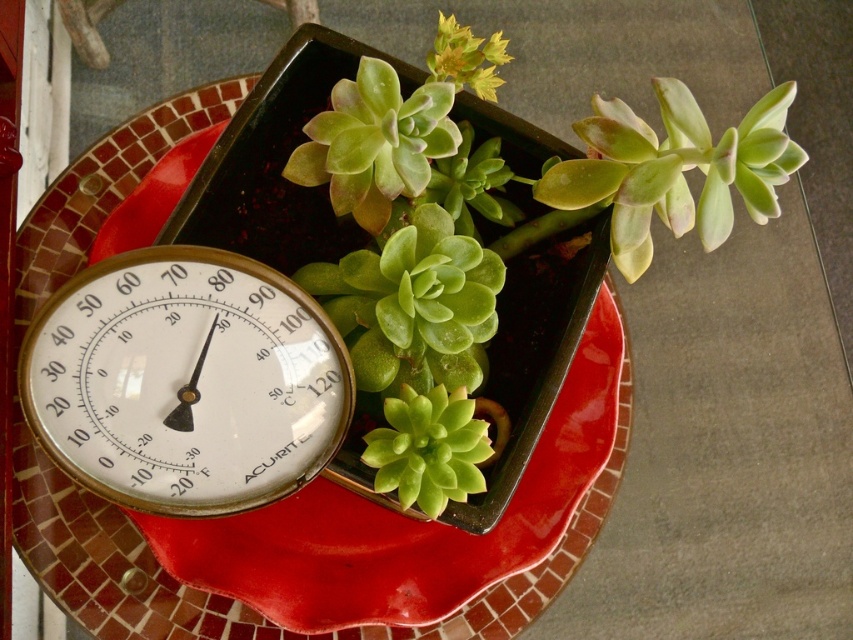
You are planning to place a decorative item on a shelf that can only hold items no larger than the green succulent at center. Can the gold metallic thermometer at lower left fit on this shelf?

The gold metallic thermometer at lower left is bigger than the green succulent at center, so it cannot fit on the shelf designed for items no larger than the green succulent at center.

You are arranging items on a table and need to place the matte ceramic platter at center and the gold metallic thermometer at lower left. According to the scene, is the platter placed above or below the thermometer?

The matte ceramic platter at center is located below the gold metallic thermometer at lower left, so the platter is placed below the thermometer.

You are a gardener who wants to place a new plant between the gold metallic thermometer at lower left and the green succulent at center. The new plant is 4 inches wide. Can you fit it there without moving either existing objects?

The gold metallic thermometer at lower left is 3.56 inches from the green succulent at center. Since the new plant is 4 inches wide, it would not fit between them as the space is smaller than the plant.